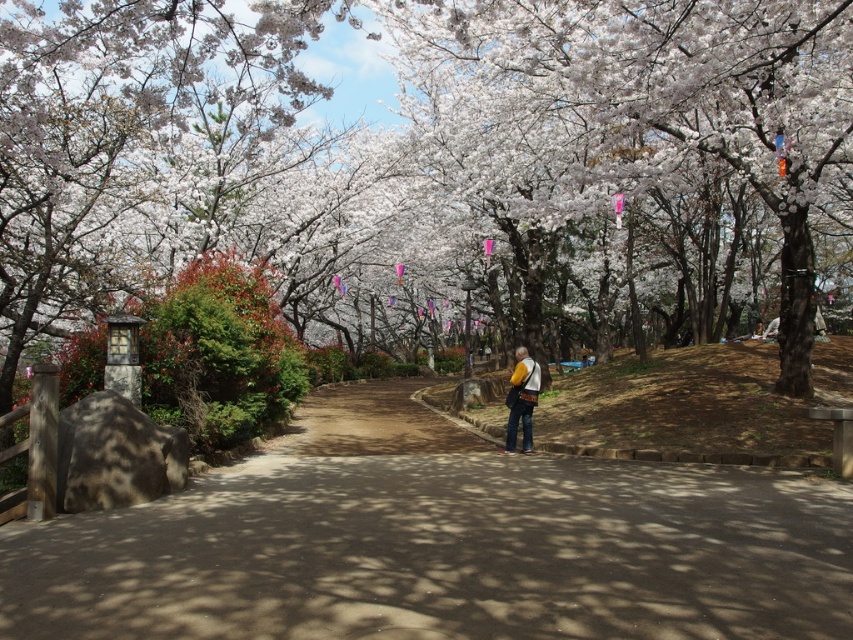
You are a photographer trying to capture the cherry blossoms in the park. You notice the white blossoms at center and the brown dirt path at center. Which object would appear larger in your photo?

The white blossoms at center would appear larger in the photo since they are bigger than the brown dirt path at center according to the description.

You are standing at the center of the park path and see both the white blossoms at center and the yellow fabric bag at center. Which object is farther away from you?

The distance between the white blossoms at center and the yellow fabric bag at center is 18.11 meters, so whichever is farther depends on your position. However, since both are at center, they are equidistant from you.

You are standing at the edge of the park and want to walk along the brown dirt path at center while carrying the yellow fabric bag at center. Since the path is narrow, will the bag fit comfortably without getting in your way?

The brown dirt path at center is bigger than yellow fabric bag at center, so the bag should fit comfortably on the path without obstructing your movement.